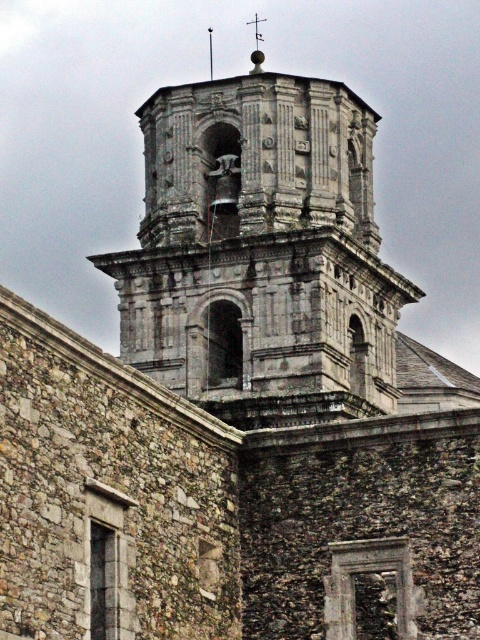
Question: Which point is closer to the camera?

Choices:
 (A) (254, 26)
 (B) (300, 397)

Answer: (B)

Question: Which of the following is the closest to the observer?

Choices:
 (A) stone bell tower at center
 (B) polished silver spire at upper center

Answer: (A)

Question: Does stone bell tower at center have a greater width compared to polished silver spire at upper center?

Choices:
 (A) yes
 (B) no

Answer: (A)

Question: Is stone bell tower at center thinner than polished silver spire at upper center?

Choices:
 (A) no
 (B) yes

Answer: (A)

Question: Does stone bell tower at center appear over polished silver spire at upper center?

Choices:
 (A) no
 (B) yes

Answer: (A)